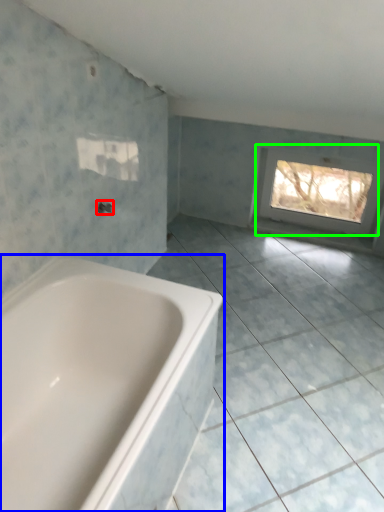
Question: Considering the real-world distances, which object is closest to tap (highlighted by a red box)? bathtub (highlighted by a blue box) or window (highlighted by a green box).

Choices:
 (A) bathtub
 (B) window

Answer: (A)